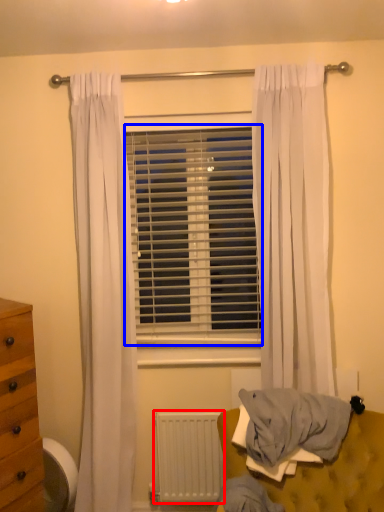
Question: Among these objects, which one is nearest to the camera, radiator (highlighted by a red box) or window blind (highlighted by a blue box)?

Choices:
 (A) radiator
 (B) window blind

Answer: (A)